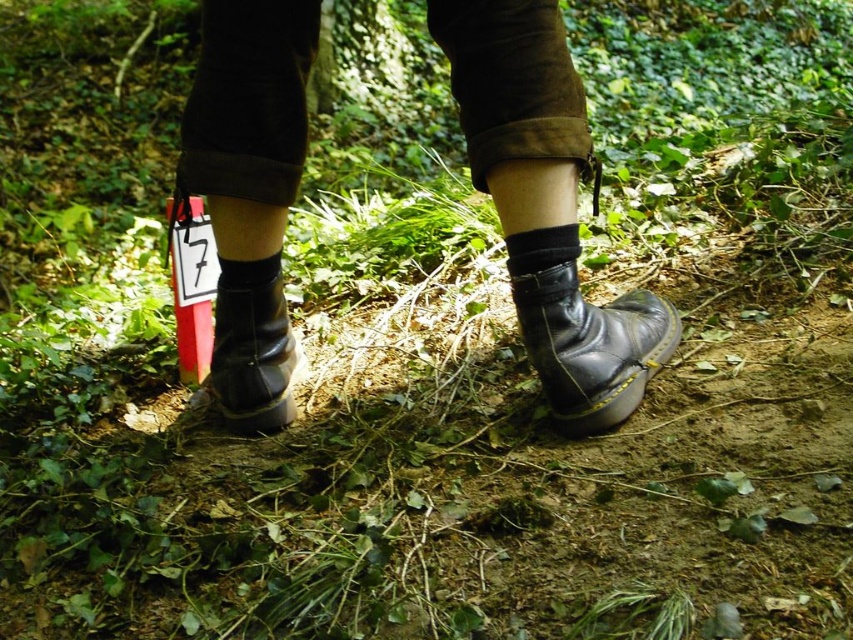
Is black leather boots at center below black cotton sock at center?

No.

Is black leather boots at center wider than black cotton sock at center?

Correct, the width of black leather boots at center exceeds that of black cotton sock at center.

Is point (508, 220) positioned after point (512, 273)?

No, it is in front of (512, 273).

The image size is (853, 640). Identify the location of black leather boots at center. (248, 120).

From the picture: Between black leather hiking boot at lower left and black cotton sock at center, which one appears on the right side from the viewer's perspective?

Positioned to the right is black cotton sock at center.

Who is lower down, black leather hiking boot at lower left or black cotton sock at center?

black leather hiking boot at lower left

Identify the location of black leather hiking boot at lower left. The image size is (853, 640). (252, 346).

Is black leather boots at center shorter than black leather boot at center?

In fact, black leather boots at center may be taller than black leather boot at center.

Between point (576, 321) and point (657, 305), which one is positioned behind?

The point (657, 305) is behind.

What do you see at coordinates (248, 120) in the screenshot?
I see `black leather boots at center` at bounding box center [248, 120].

You are a GUI agent. You are given a task and a screenshot of the screen. Output one action in this format:
    pyautogui.click(x=<x>, y=<y>)
    Task: Click on the black leather boots at center
    The height and width of the screenshot is (640, 853).
    Given the screenshot: What is the action you would take?
    pyautogui.click(x=248, y=120)